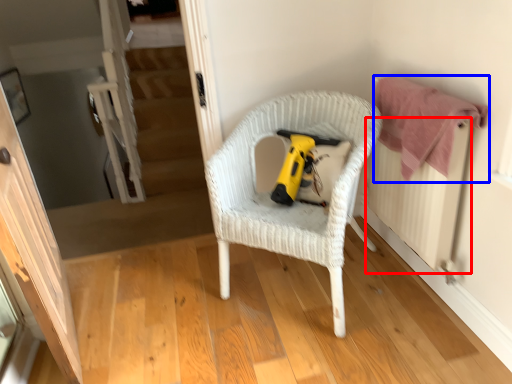
Question: Which object is closer to the camera taking this photo, radiator (highlighted by a red box) or clothe (highlighted by a blue box)?

Choices:
 (A) radiator
 (B) clothe

Answer: (A)